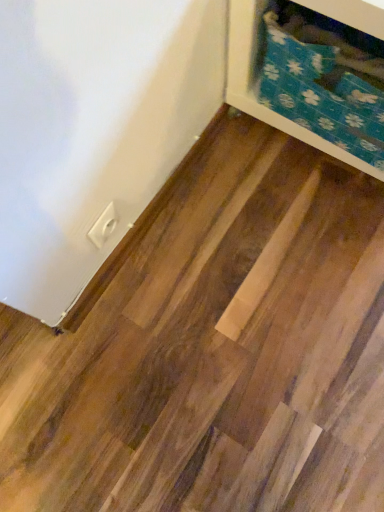
Question: From the image's perspective, is white plastic outlet at lower left beneath blue floral fabric at upper right?

Choices:
 (A) yes
 (B) no

Answer: (A)

Question: Can you confirm if white plastic outlet at lower left is bigger than blue floral fabric at upper right?

Choices:
 (A) no
 (B) yes

Answer: (A)

Question: Is white plastic outlet at lower left closer to the viewer compared to blue floral fabric at upper right?

Choices:
 (A) no
 (B) yes

Answer: (A)

Question: Considering the relative sizes of white plastic outlet at lower left and blue floral fabric at upper right in the image provided, is white plastic outlet at lower left taller than blue floral fabric at upper right?

Choices:
 (A) yes
 (B) no

Answer: (B)

Question: Does white plastic outlet at lower left have a lesser height compared to blue floral fabric at upper right?

Choices:
 (A) no
 (B) yes

Answer: (B)

Question: Can you confirm if white plastic outlet at lower left is wider than blue floral fabric at upper right?

Choices:
 (A) yes
 (B) no

Answer: (B)

Question: Is blue floral fabric at upper right at the right side of white plastic outlet at lower left?

Choices:
 (A) yes
 (B) no

Answer: (A)

Question: Is blue floral fabric at upper right to the left of white plastic outlet at lower left from the viewer's perspective?

Choices:
 (A) yes
 (B) no

Answer: (B)

Question: From a real-world perspective, is blue floral fabric at upper right below white plastic outlet at lower left?

Choices:
 (A) yes
 (B) no

Answer: (B)

Question: Can you confirm if blue floral fabric at upper right is thinner than white plastic outlet at lower left?

Choices:
 (A) yes
 (B) no

Answer: (B)

Question: Does blue floral fabric at upper right have a greater width compared to white plastic outlet at lower left?

Choices:
 (A) no
 (B) yes

Answer: (B)

Question: Considering the relative sizes of blue floral fabric at upper right and white plastic outlet at lower left in the image provided, is blue floral fabric at upper right smaller than white plastic outlet at lower left?

Choices:
 (A) no
 (B) yes

Answer: (A)

Question: Does point (100, 230) appear closer or farther from the camera than point (269, 110)?

Choices:
 (A) closer
 (B) farther

Answer: (A)